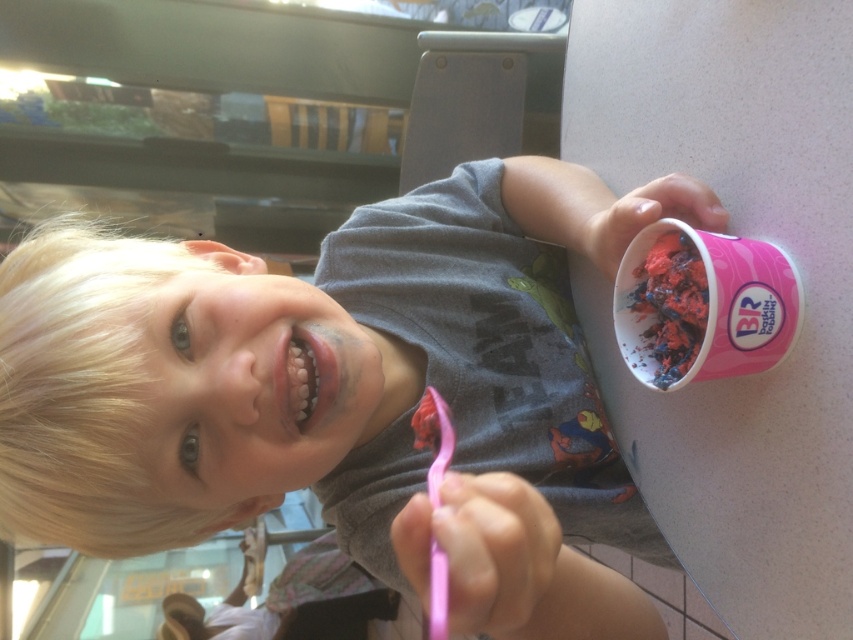
Between white glossy teeth at center and pink plastic toothbrush at lower center, which one has more height?

pink plastic toothbrush at lower center

Based on the photo, between white glossy teeth at center and pink plastic toothbrush at lower center, which one has less height?

Standing shorter between the two is white glossy teeth at center.

Between point (315, 385) and point (431, 573), which one is positioned behind?

The point (315, 385) is more distant.

Find the location of `white glossy teeth at center`. white glossy teeth at center is located at coordinates (305, 378).

Who is more forward, [302,296] or [312,342]?

Point [312,342]

Looking at this image, which is above, pink matte ice cream cup at right or white glossy teeth at center?

Positioned higher is white glossy teeth at center.

This screenshot has width=853, height=640. I want to click on pink matte ice cream cup at right, so click(x=345, y=394).

Identify the location of pink matte ice cream cup at right. (345, 394).

Is pink matte ice cream cup at right wider than pink plastic toothbrush at lower center?

Yes.

Is pink matte ice cream cup at right taller than pink plastic toothbrush at lower center?

Yes, pink matte ice cream cup at right is taller than pink plastic toothbrush at lower center.

The image size is (853, 640). I want to click on pink matte ice cream cup at right, so click(x=345, y=394).

Where is `pink matte ice cream cup at right`? The image size is (853, 640). pink matte ice cream cup at right is located at coordinates (345, 394).